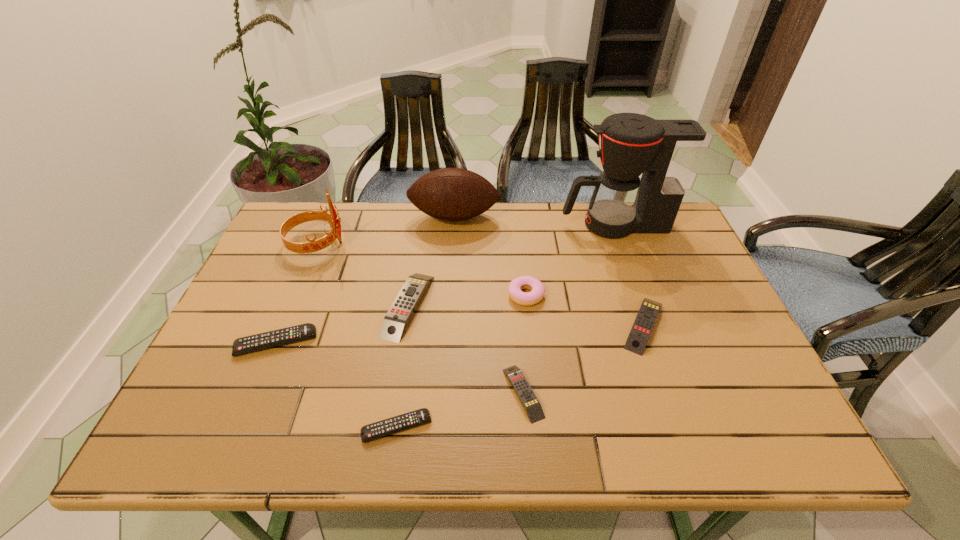
The height and width of the screenshot is (540, 960). Find the location of `vacant space situated 0.380m on the left of the doughnut`. vacant space situated 0.380m on the left of the doughnut is located at coordinates (365, 295).

I want to click on free space located on the left of the leftmost yellow remote control, so click(339, 306).

Where is `vacant region located on the left of the fourth shortest remote control`? This screenshot has height=540, width=960. vacant region located on the left of the fourth shortest remote control is located at coordinates (592, 325).

You are a GUI agent. You are given a task and a screenshot of the screen. Output one action in this format:
    pyautogui.click(x=<x>, y=<y>)
    Task: Click on the free space located on the back of the bigger black remote control
    
    Given the screenshot: What is the action you would take?
    pyautogui.click(x=313, y=251)

At what (x,y) coordinates should I click in order to perform the action: click on vacant area located on the right of the second yellow remote control from left to right. Please return your answer as a coordinate pair (x, y). Looking at the image, I should click on (708, 393).

Identify the location of vacant space located on the back of the right black remote control. This screenshot has width=960, height=540. (406, 363).

At what (x,y) coordinates should I click in order to perform the action: click on coffee maker at the far edge. Please return your answer as a coordinate pair (x, y). Looking at the image, I should click on (665, 152).

Find the location of a particular element. The image size is (960, 540). tiara situated at the far edge is located at coordinates (332, 218).

The width and height of the screenshot is (960, 540). What are the coordinates of `football that is at the far edge` in the screenshot? It's located at (453, 194).

This screenshot has height=540, width=960. Find the location of `tiara present at the left edge`. tiara present at the left edge is located at coordinates (332, 218).